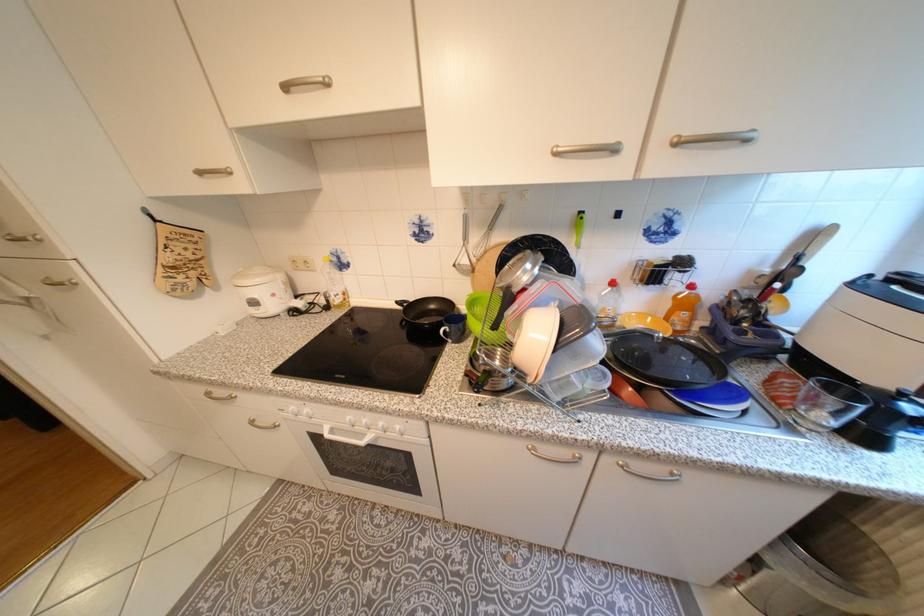
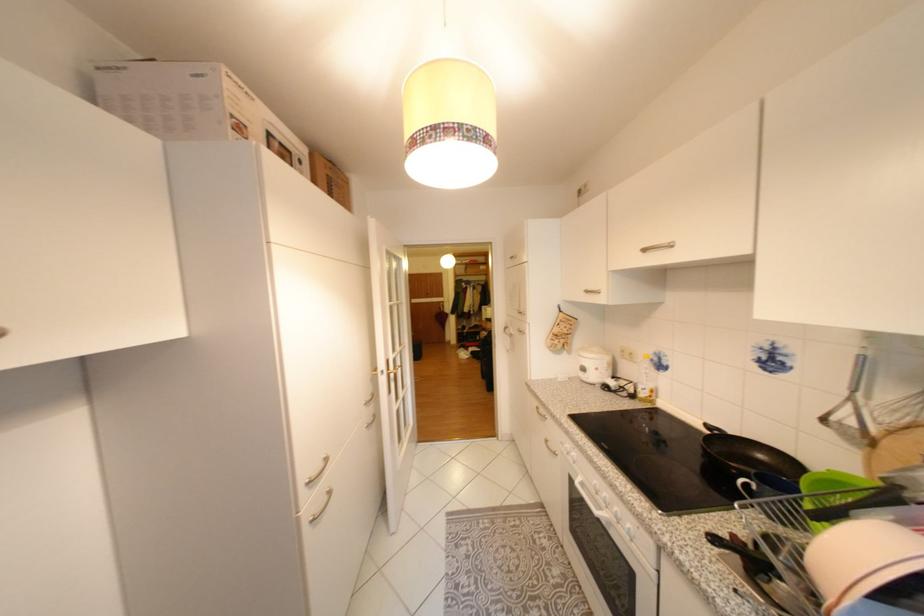
Find the pixel in the second image that matches (x=210, y=174) in the first image.

(596, 292)